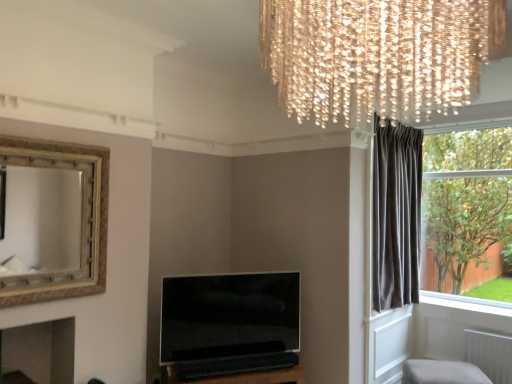
Question: Is gold textured mirror at upper left further to the viewer compared to crystal chandelier at upper center?

Choices:
 (A) no
 (B) yes

Answer: (B)

Question: From the image's perspective, is gold textured mirror at upper left over crystal chandelier at upper center?

Choices:
 (A) yes
 (B) no

Answer: (B)

Question: Is gold textured mirror at upper left looking in the opposite direction of crystal chandelier at upper center?

Choices:
 (A) yes
 (B) no

Answer: (B)

Question: Does gold textured mirror at upper left have a larger size compared to crystal chandelier at upper center?

Choices:
 (A) no
 (B) yes

Answer: (A)

Question: Is gold textured mirror at upper left beside crystal chandelier at upper center?

Choices:
 (A) yes
 (B) no

Answer: (B)

Question: Considering the positions of point (415, 362) and point (87, 145), is point (415, 362) closer or farther from the camera than point (87, 145)?

Choices:
 (A) closer
 (B) farther

Answer: (B)

Question: Considering the positions of light beige fabric ottoman at lower right and gold textured mirror at upper left in the image, is light beige fabric ottoman at lower right wider or thinner than gold textured mirror at upper left?

Choices:
 (A) wide
 (B) thin

Answer: (A)

Question: From a real-world perspective, is light beige fabric ottoman at lower right physically located above or below gold textured mirror at upper left?

Choices:
 (A) above
 (B) below

Answer: (B)

Question: Considering the positions of light beige fabric ottoman at lower right and gold textured mirror at upper left in the image, is light beige fabric ottoman at lower right taller or shorter than gold textured mirror at upper left?

Choices:
 (A) short
 (B) tall

Answer: (A)

Question: Based on their positions, is dark velvet curtain at right located to the left or right of light beige fabric ottoman at lower right?

Choices:
 (A) right
 (B) left

Answer: (B)

Question: Looking at the image, does dark velvet curtain at right seem bigger or smaller compared to light beige fabric ottoman at lower right?

Choices:
 (A) big
 (B) small

Answer: (A)

Question: Choose the correct answer: Is dark velvet curtain at right inside light beige fabric ottoman at lower right or outside it?

Choices:
 (A) outside
 (B) inside

Answer: (A)

Question: From the image's perspective, is dark velvet curtain at right above or below light beige fabric ottoman at lower right?

Choices:
 (A) below
 (B) above

Answer: (B)

Question: Considering their positions, is crystal chandelier at upper center located in front of or behind flat-screen tv at center?

Choices:
 (A) behind
 (B) front

Answer: (B)

Question: Choose the correct answer: Is crystal chandelier at upper center inside flat-screen tv at center or outside it?

Choices:
 (A) inside
 (B) outside

Answer: (B)